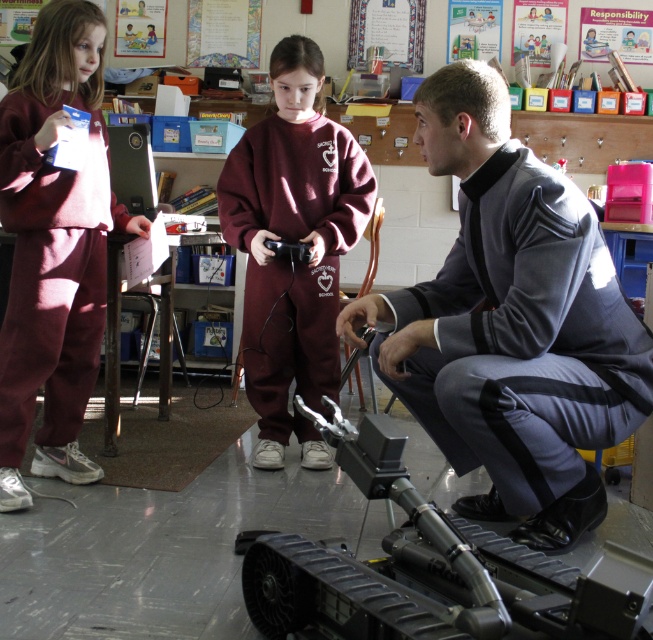
Question: Observing the image, what is the correct spatial positioning of gray fabric uniform at center in reference to maroon fleece sweatshirt at center?

Choices:
 (A) above
 (B) below

Answer: (B)

Question: Estimate the real-world distances between objects in this image. Which object is closer to the maroon fleece sweatshirt at center?

Choices:
 (A) maroon fleece pants at left
 (B) metallic/textured robot at lower center

Answer: (A)

Question: From the image, what is the correct spatial relationship of gray fabric uniform at center in relation to maroon fleece sweatshirt at center?

Choices:
 (A) above
 (B) below

Answer: (B)

Question: Which point appears closest to the camera in this image?

Choices:
 (A) (300, 314)
 (B) (29, 225)

Answer: (B)

Question: Which is nearer to the maroon fleece pants at left?

Choices:
 (A) metallic/textured robot at lower center
 (B) gray fabric uniform at center

Answer: (A)

Question: Does maroon fleece pants at left appear on the right side of maroon fleece sweatshirt at center?

Choices:
 (A) no
 (B) yes

Answer: (A)